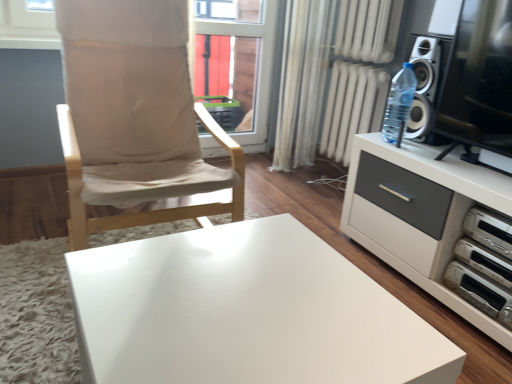
Question: Does transparent glass window at center have a lesser height compared to white sheer curtain at center?

Choices:
 (A) no
 (B) yes

Answer: (B)

Question: Does transparent glass window at center come in front of white sheer curtain at center?

Choices:
 (A) yes
 (B) no

Answer: (B)

Question: From the image's perspective, does transparent glass window at center appear lower than white sheer curtain at center?

Choices:
 (A) yes
 (B) no

Answer: (B)

Question: Is transparent glass window at center at the right side of white sheer curtain at center?

Choices:
 (A) no
 (B) yes

Answer: (A)

Question: Does transparent glass window at center have a larger size compared to white sheer curtain at center?

Choices:
 (A) no
 (B) yes

Answer: (A)

Question: Can you confirm if transparent glass window at center is thinner than white sheer curtain at center?

Choices:
 (A) yes
 (B) no

Answer: (A)

Question: Considering the relative positions of white plastic dvd player at lower right, which appears as the first appliance when ordered from the bottom, and white glossy table at center in the image provided, is white plastic dvd player at lower right, which appears as the first appliance when ordered from the bottom, to the left of white glossy table at center from the viewer's perspective?

Choices:
 (A) no
 (B) yes

Answer: (A)

Question: Is white plastic dvd player at lower right, which appears as the first appliance when ordered from the bottom, far away from white glossy table at center?

Choices:
 (A) yes
 (B) no

Answer: (B)

Question: Is white plastic dvd player at lower right, which appears as the first appliance when ordered from the bottom, with white glossy table at center?

Choices:
 (A) no
 (B) yes

Answer: (A)

Question: Is white plastic dvd player at lower right, which appears as the first appliance when ordered from the bottom, positioned with its back to white glossy table at center?

Choices:
 (A) no
 (B) yes

Answer: (A)

Question: From the image's perspective, is white plastic dvd player at lower right, which appears as the first appliance when ordered from the bottom, located beneath white glossy table at center?

Choices:
 (A) no
 (B) yes

Answer: (A)

Question: Can you confirm if white plastic dvd player at lower right, which appears as the first appliance when ordered from the bottom, is positioned to the right of white glossy table at center?

Choices:
 (A) yes
 (B) no

Answer: (A)

Question: Is white plastic dvd player at lower right, placed as the 2th appliance when sorted from top to bottom, to the right of white plastic dvd player at right, which is the 2th appliance in bottom-to-top order, from the viewer's perspective?

Choices:
 (A) no
 (B) yes

Answer: (A)